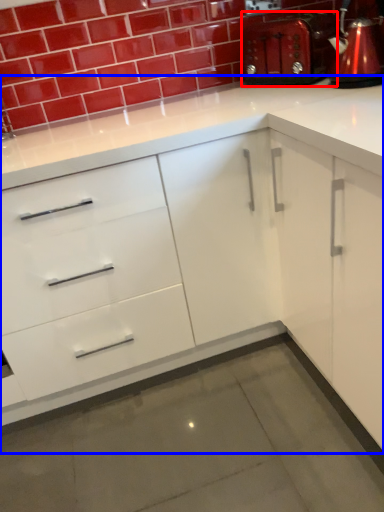
Question: Which object appears farthest to the camera in this image, appliance (highlighted by a red box) or cabinetry (highlighted by a blue box)?

Choices:
 (A) appliance
 (B) cabinetry

Answer: (A)